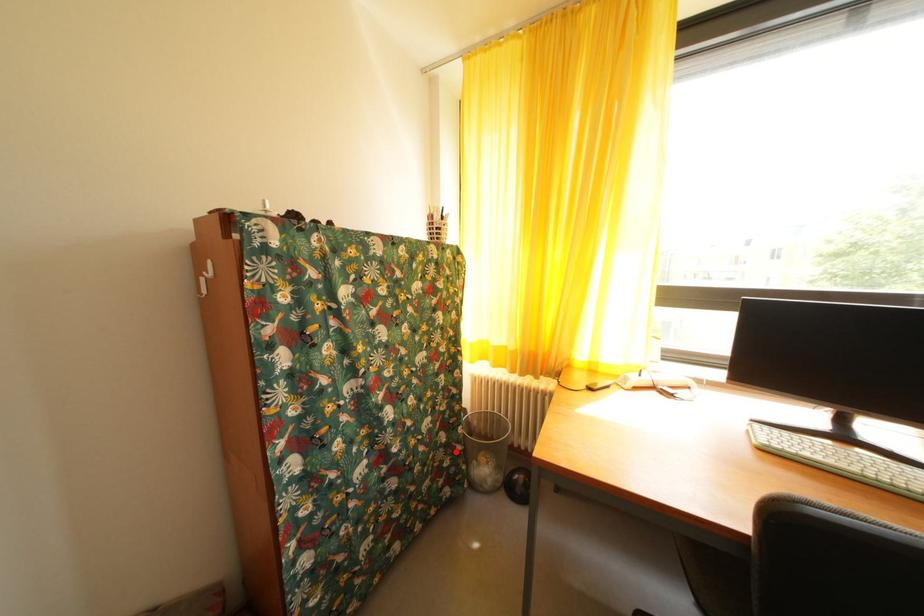
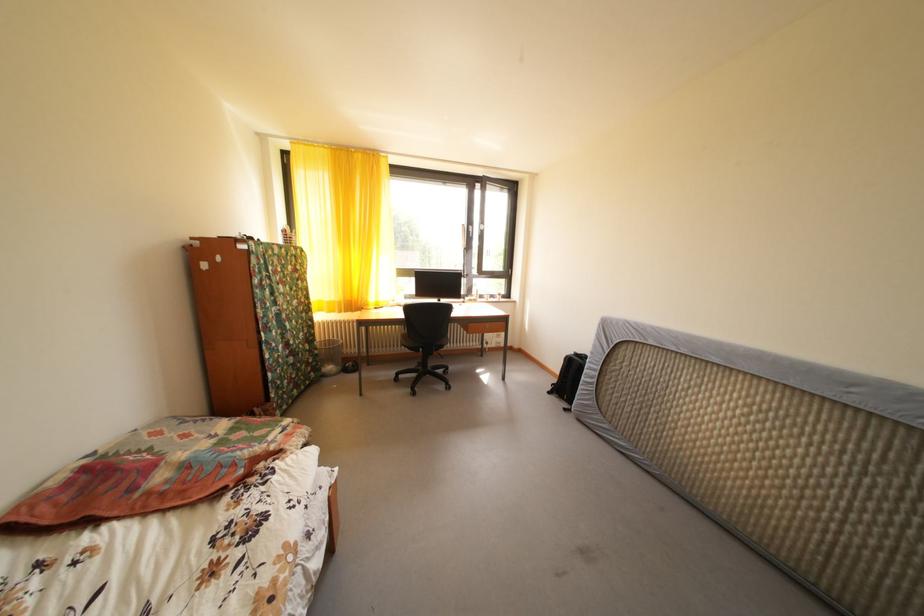
Find the pixel in the second image that matches the highlighted location in the first image.

(320, 357)